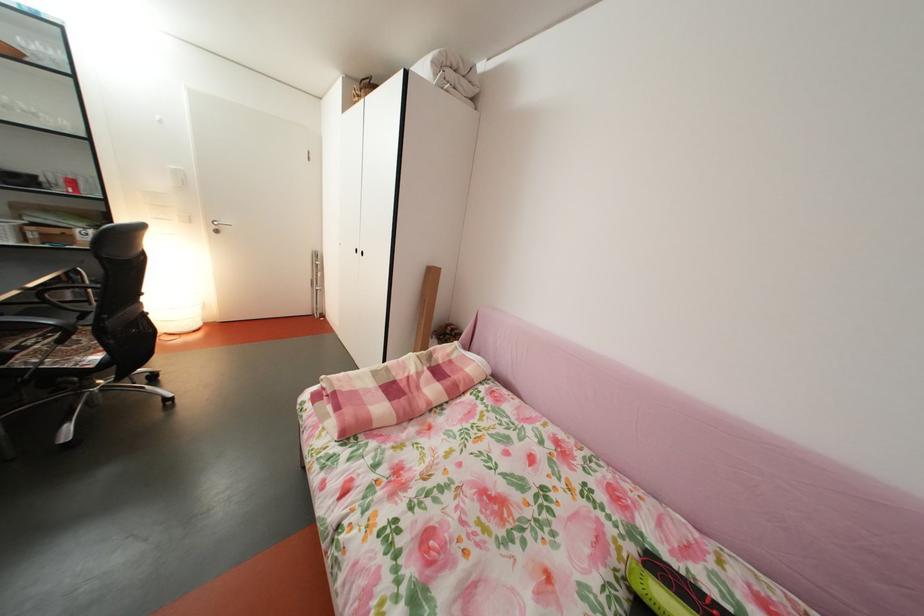
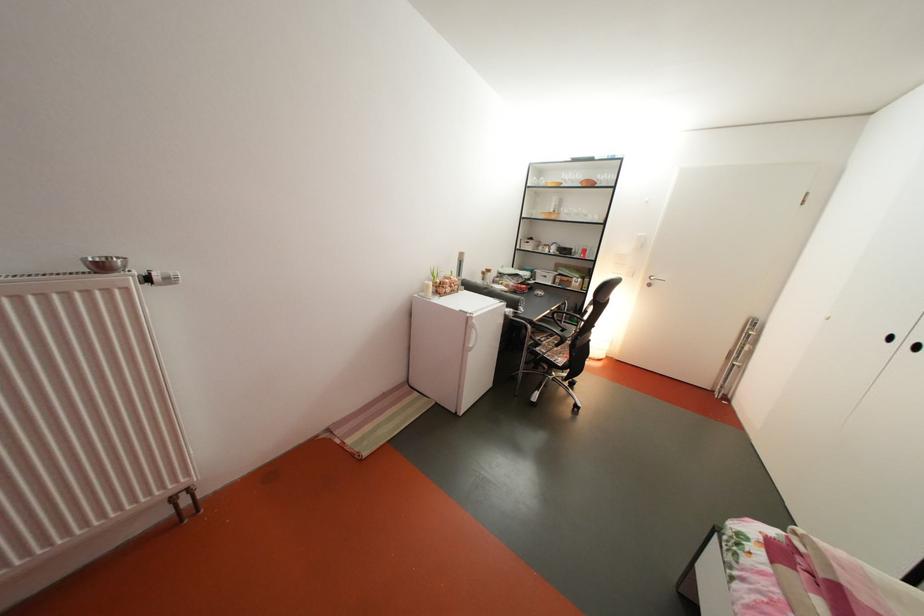
Where in the second image is the point corresponding to the point at 46,121 from the first image?

(598, 222)